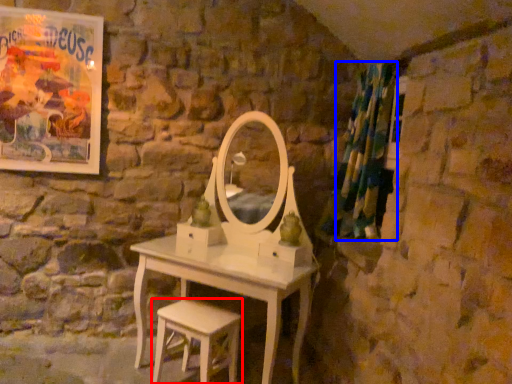
Question: Which object appears farthest to the camera in this image, stool (highlighted by a red box) or shower curtain (highlighted by a blue box)?

Choices:
 (A) stool
 (B) shower curtain

Answer: (B)